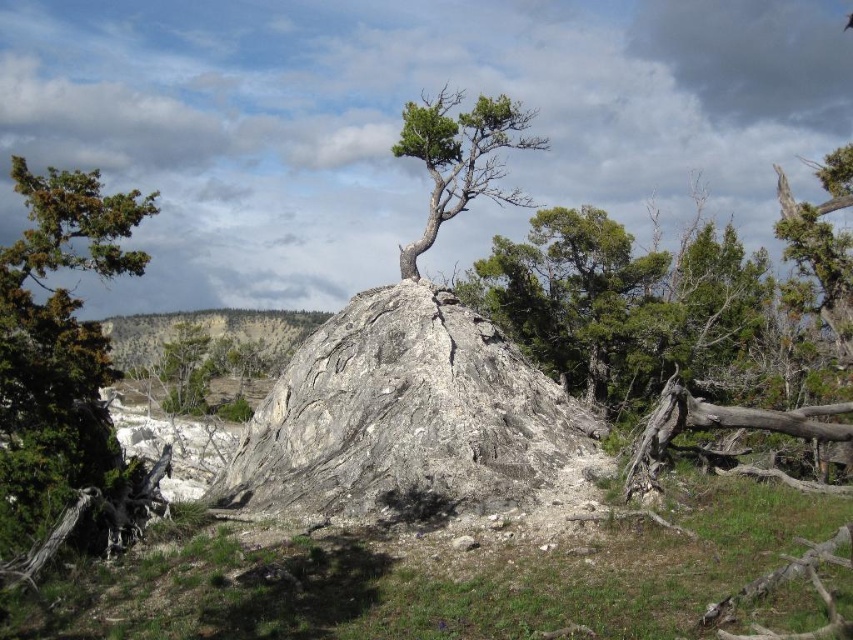
You are a geologist examining the image of the rugged landscape. You notice a point marked at coordinates (410, 420). Based on the scene description, can you determine which object this point is located on?

The point at coordinates (410, 420) is located on the gray rough rock at center.

You are standing in the natural landscape and want to place a small flag at the highest point between the gray rough rock at center and the green rough bark tree at left. Which object should you place the flag on?

The green rough bark tree at left is higher than the gray rough rock at center, so you should place the flag on the green rough bark tree at left.

You are an environmental scientist examining the landscape. You notice the gray rough rock at center and the green textured tree at center. Which object occupies a larger area in the scene?

The green textured tree at center occupies a larger area in the scene because the gray rough rock at center has a smaller size compared to it.